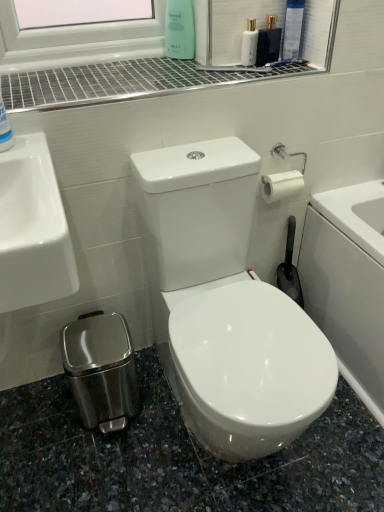
Question: Does white glossy mouthwash at upper center lie in front of blue glossy bottle at upper left, positioned as the first cleaning product in bottom-to-top order?

Choices:
 (A) no
 (B) yes

Answer: (A)

Question: Would you consider white glossy mouthwash at upper center to be distant from blue glossy bottle at upper left, which is counted as the second cleaning product, starting from the top?

Choices:
 (A) yes
 (B) no

Answer: (B)

Question: From a real-world perspective, does white glossy mouthwash at upper center stand above blue glossy bottle at upper left, which appears as the 2th cleaning product when viewed from the back?

Choices:
 (A) yes
 (B) no

Answer: (A)

Question: Is blue glossy bottle at upper left, positioned as the first cleaning product in bottom-to-top order, at the back of white glossy mouthwash at upper center?

Choices:
 (A) no
 (B) yes

Answer: (A)

Question: From the image's perspective, is white glossy mouthwash at upper center over blue glossy bottle at upper left, placed as the 1th cleaning product when sorted from left to right?

Choices:
 (A) yes
 (B) no

Answer: (A)

Question: Is white glossy mouthwash at upper center wider than blue glossy bottle at upper left, positioned as the 2th cleaning product in right-to-left order?

Choices:
 (A) no
 (B) yes

Answer: (A)

Question: From a real-world perspective, is metallic grid at upper center under green matte bottle at upper center, which appears as the 1th cleaning product when viewed from the top?

Choices:
 (A) no
 (B) yes

Answer: (B)

Question: Considering the relative positions of metallic grid at upper center and green matte bottle at upper center, marked as the first cleaning product in a back-to-front arrangement, in the image provided, is metallic grid at upper center behind green matte bottle at upper center, marked as the first cleaning product in a back-to-front arrangement,?

Choices:
 (A) yes
 (B) no

Answer: (B)

Question: From the image's perspective, is metallic grid at upper center under green matte bottle at upper center, which is the 2th cleaning product from left to right?

Choices:
 (A) no
 (B) yes

Answer: (B)

Question: Considering the relative sizes of metallic grid at upper center and green matte bottle at upper center, which ranks as the 2th cleaning product in bottom-to-top order, in the image provided, is metallic grid at upper center smaller than green matte bottle at upper center, which ranks as the 2th cleaning product in bottom-to-top order,?

Choices:
 (A) no
 (B) yes

Answer: (A)

Question: Is metallic grid at upper center wider than green matte bottle at upper center, which is counted as the first cleaning product, starting from the right?

Choices:
 (A) yes
 (B) no

Answer: (A)

Question: Considering the relative sizes of metallic grid at upper center and green matte bottle at upper center, the second cleaning product viewed from the front, in the image provided, is metallic grid at upper center thinner than green matte bottle at upper center, the second cleaning product viewed from the front,?

Choices:
 (A) no
 (B) yes

Answer: (A)

Question: Considering the relative sizes of blue glossy bottle at upper left, which appears as the 2th cleaning product when viewed from the back, and green matte bottle at upper center, the second cleaning product viewed from the front, in the image provided, is blue glossy bottle at upper left, which appears as the 2th cleaning product when viewed from the back, thinner than green matte bottle at upper center, the second cleaning product viewed from the front,?

Choices:
 (A) yes
 (B) no

Answer: (B)